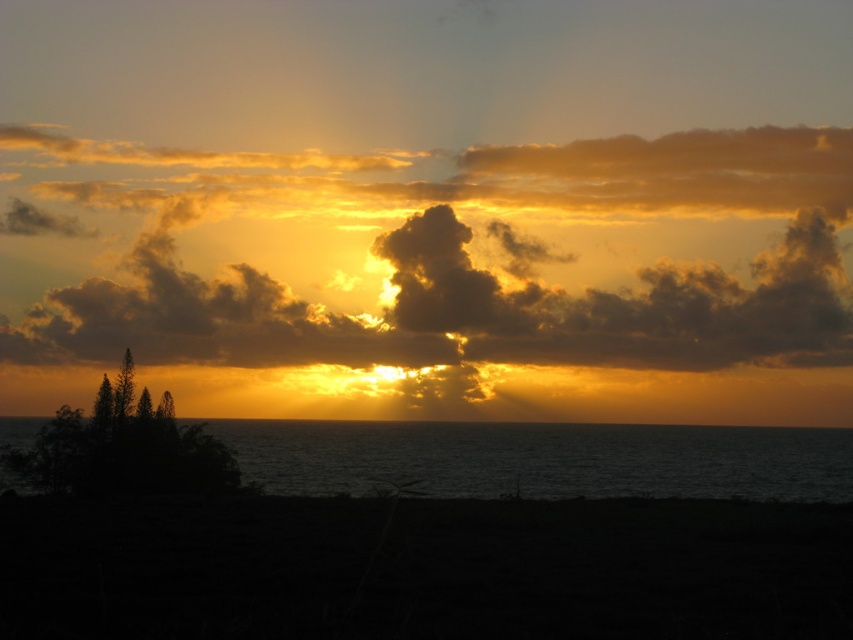
Who is positioned more to the right, golden matte cloud at upper center or dark water at lower center?

From the viewer's perspective, dark water at lower center appears more on the right side.

Looking at this image, between golden matte cloud at upper center and dark water at lower center, which one has less height?

With less height is dark water at lower center.

Between point (102, 339) and point (218, 435), which one is positioned in front?

Point (218, 435) is in front.

The image size is (853, 640). Find the location of `golden matte cloud at upper center`. golden matte cloud at upper center is located at coordinates (457, 312).